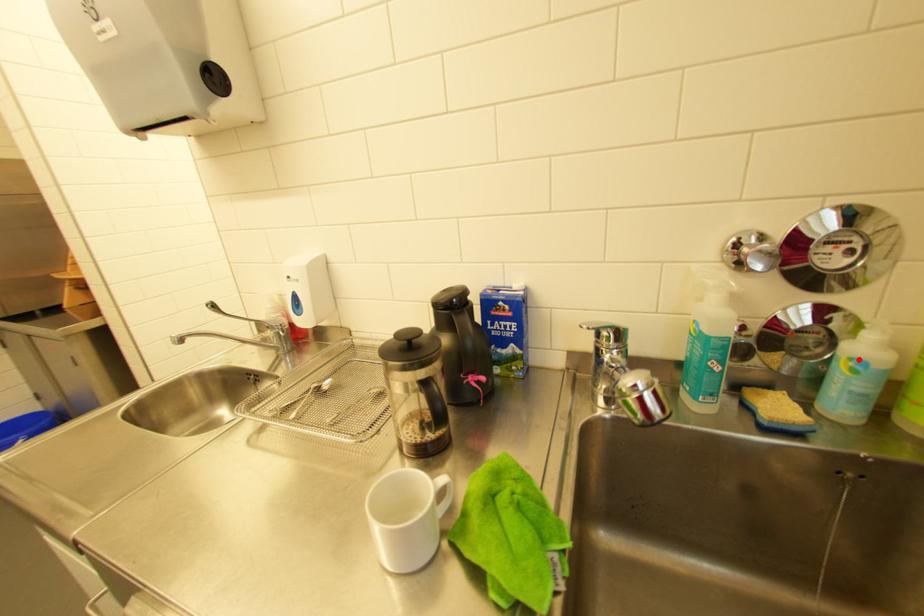
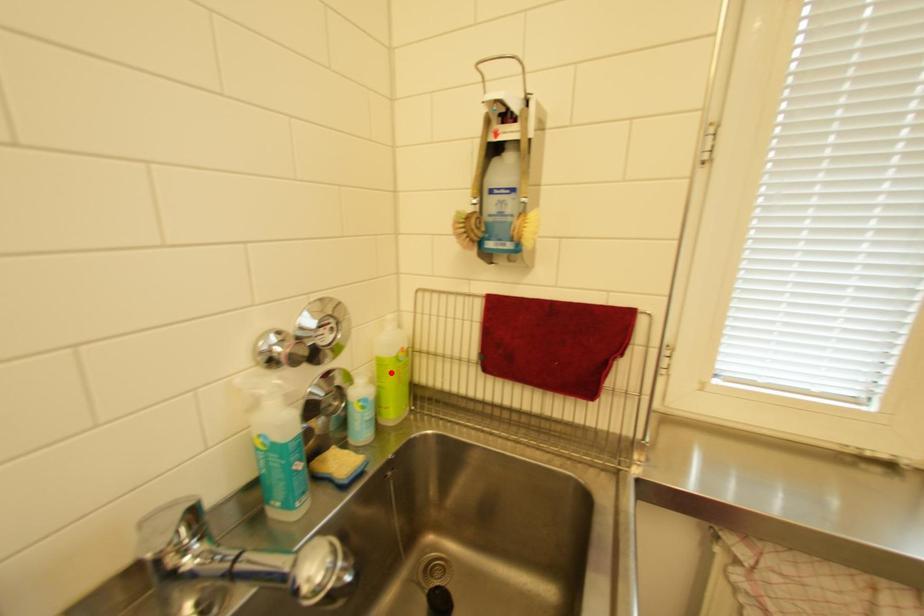
I am providing you with two images of the same scene from different viewpoints. A red point is marked on the first image and another point is marked on the second image. Do the highlighted points in image1 and image2 indicate the same real-world spot?

No